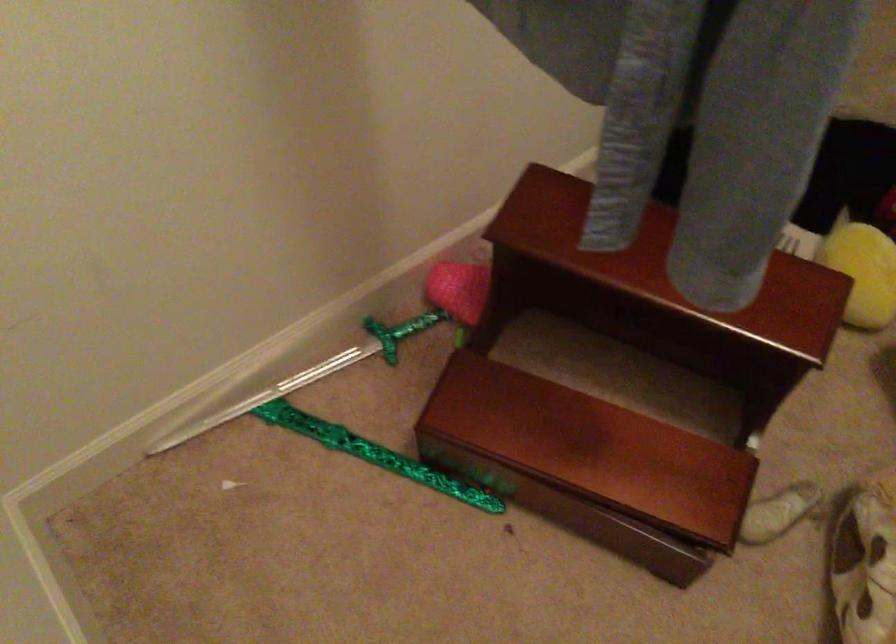
Find where to grasp the green toy handle. Please return your answer as a coordinate pair (x, y).

(382, 339)